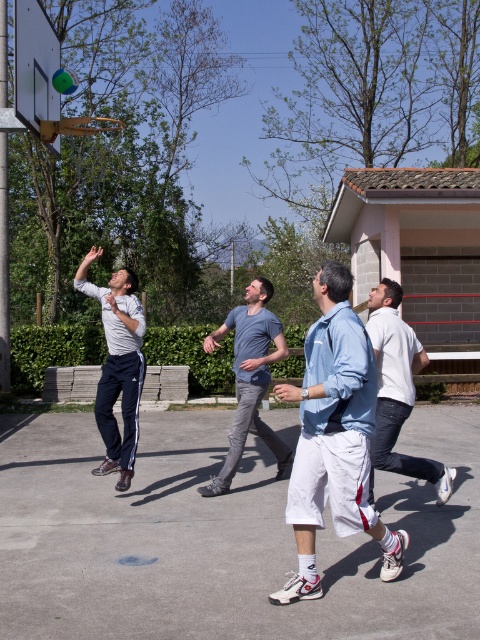
Is matte gray sweatshirt at left wider than gray cotton t-shirt at center?

No.

Between point (110, 432) and point (257, 412), which one is positioned behind?

Point (257, 412)

Who is more distant from viewer, (x=116, y=305) or (x=283, y=468)?

The point (x=283, y=468) is more distant.

You are a GUI agent. You are given a task and a screenshot of the screen. Output one action in this format:
    pyautogui.click(x=<x>, y=<y>)
    Task: Click on the matte gray sweatshirt at left
    The image size is (480, 640).
    Given the screenshot: What is the action you would take?
    pyautogui.click(x=118, y=365)

Who is more forward, [123,435] or [373,461]?

Positioned in front is point [373,461].

This screenshot has width=480, height=640. What do you see at coordinates (118, 365) in the screenshot?
I see `matte gray sweatshirt at left` at bounding box center [118, 365].

Image resolution: width=480 pixels, height=640 pixels. What are the coordinates of `matte gray sweatshirt at left` in the screenshot? It's located at (118, 365).

The height and width of the screenshot is (640, 480). Find the location of `matte gray sweatshirt at left`. matte gray sweatshirt at left is located at coordinates (118, 365).

Does point (457, 588) come behind point (130, 381)?

No.

Who is more forward, (58, 563) or (107, 342)?

Point (58, 563) is in front.

Where is `white cotton shorts at center`? The width and height of the screenshot is (480, 640). white cotton shorts at center is located at coordinates (220, 538).